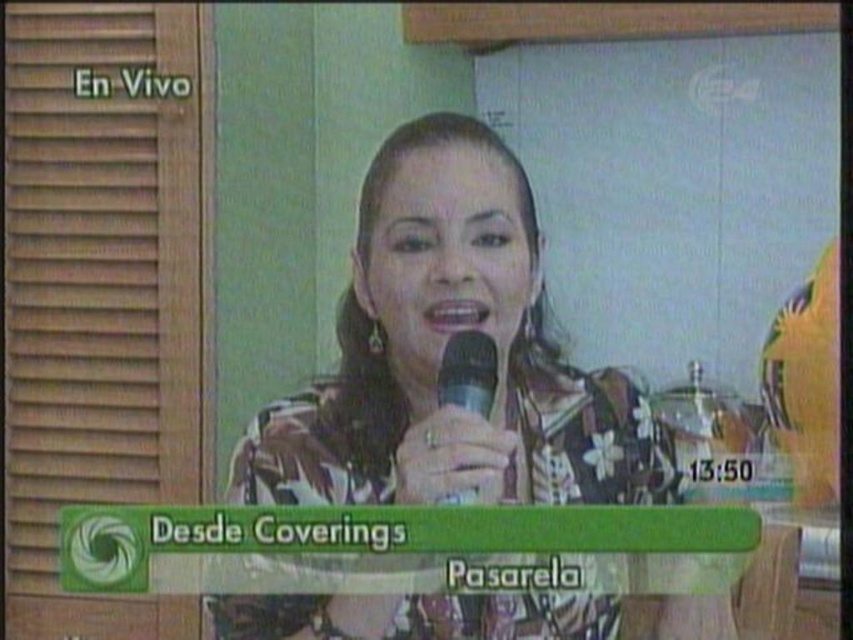
Question: Which point is farther to the camera?

Choices:
 (A) (570, 435)
 (B) (463, 364)

Answer: (A)

Question: Which of the following is the closest to the observer?

Choices:
 (A) floral-patterned blouse at center
 (B) matte black microphone at center

Answer: (A)

Question: Does floral-patterned blouse at center have a smaller size compared to matte black microphone at center?

Choices:
 (A) yes
 (B) no

Answer: (B)

Question: Does floral-patterned blouse at center appear over matte black microphone at center?

Choices:
 (A) yes
 (B) no

Answer: (B)

Question: In this image, where is floral-patterned blouse at center located relative to matte black microphone at center?

Choices:
 (A) below
 (B) above

Answer: (A)